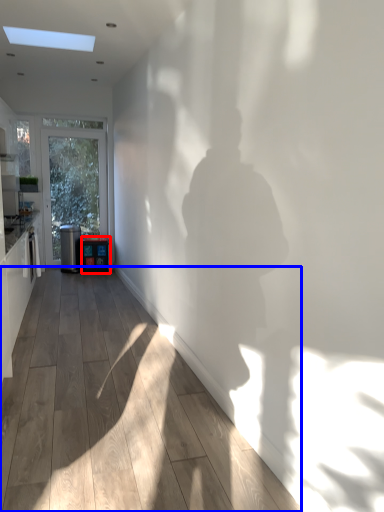
Question: Which object is closer to the camera taking this photo, appliance (highlighted by a red box) or corridor (highlighted by a blue box)?

Choices:
 (A) appliance
 (B) corridor

Answer: (B)